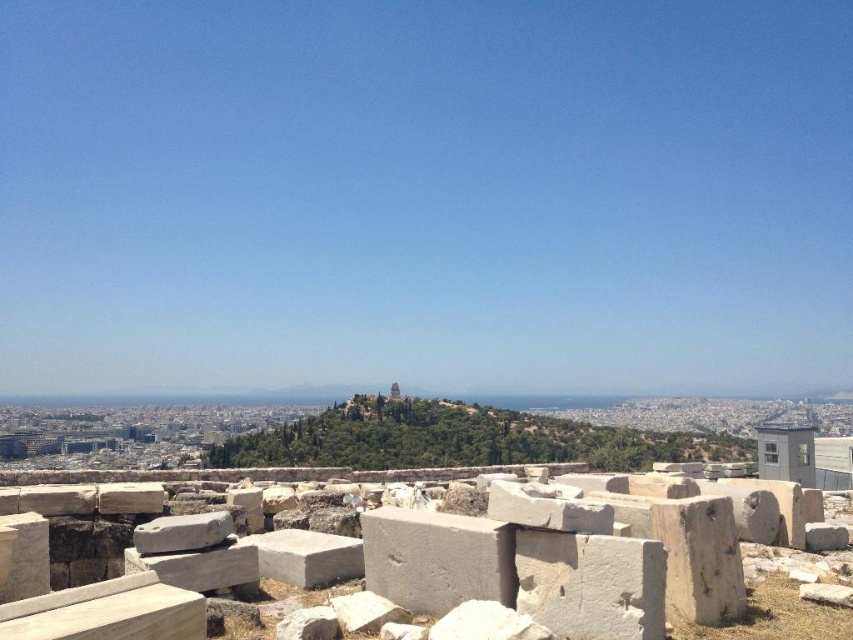
Is point (645, 534) positioned behind point (427, 400)?

No, it is not.

Is white stone ruins at center positioned at the back of green leafy hillside at center?

No, white stone ruins at center is in front of green leafy hillside at center.

Is point (675, 572) in front of point (627, 452)?

Yes, it is.

Locate an element on the screen. white stone ruins at center is located at coordinates (440, 561).